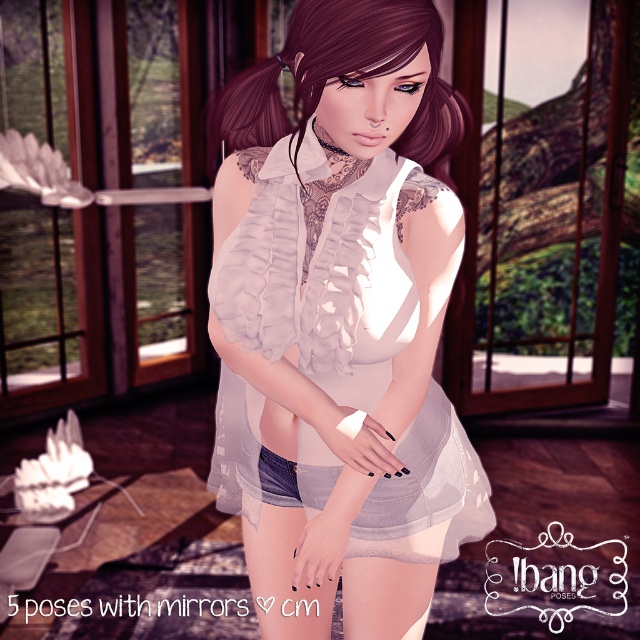
Is white sheer blouse at center wider than matte white blouse at center?

Yes, white sheer blouse at center is wider than matte white blouse at center.

Consider the image. Can you confirm if white sheer blouse at center is positioned below matte white blouse at center?

Indeed, white sheer blouse at center is positioned under matte white blouse at center.

Is point (394, 259) farther from camera compared to point (360, 48)?

Yes, point (394, 259) is behind point (360, 48).

Identify the location of white sheer blouse at center. (339, 317).